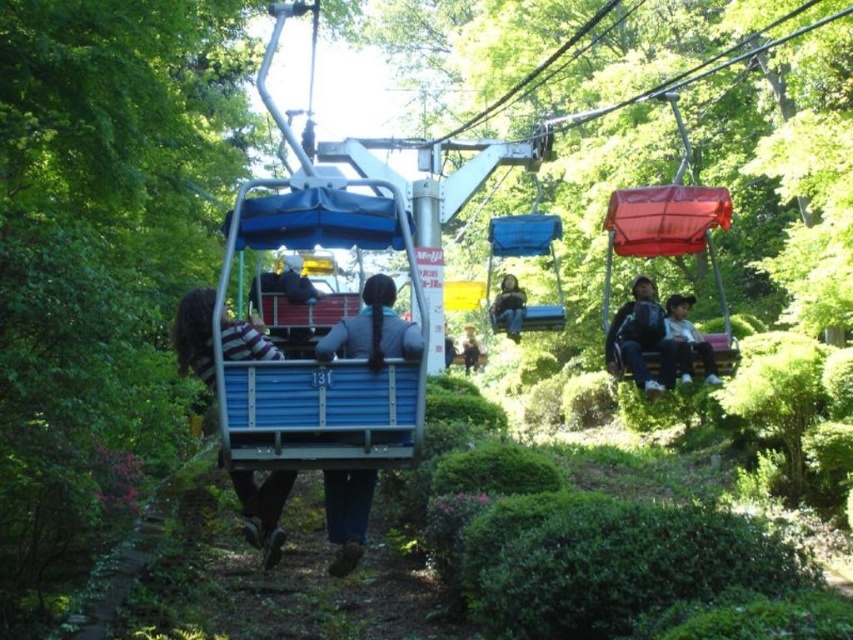
Question: Among these points, which one is farthest from the camera?

Choices:
 (A) (685, 358)
 (B) (280, 352)
 (C) (648, 314)

Answer: (C)

Question: Which object appears closest to the camera in this image?

Choices:
 (A) matte black backpack at right
 (B) matte gray jacket at center

Answer: (A)

Question: Is striped fabric shirt at center above matte gray jacket at center?

Choices:
 (A) yes
 (B) no

Answer: (A)

Question: Is matte black jacket at right in front of matte blue jacket at center?

Choices:
 (A) no
 (B) yes

Answer: (B)

Question: Can you confirm if striped fabric shirt at center is positioned to the left of matte black backpack at right?

Choices:
 (A) no
 (B) yes

Answer: (B)

Question: Which object is farther from the camera taking this photo?

Choices:
 (A) matte blue jacket at center
 (B) matte black jacket at right
 (C) blue fabric backpack at center
 (D) matte gray jacket at center

Answer: (D)